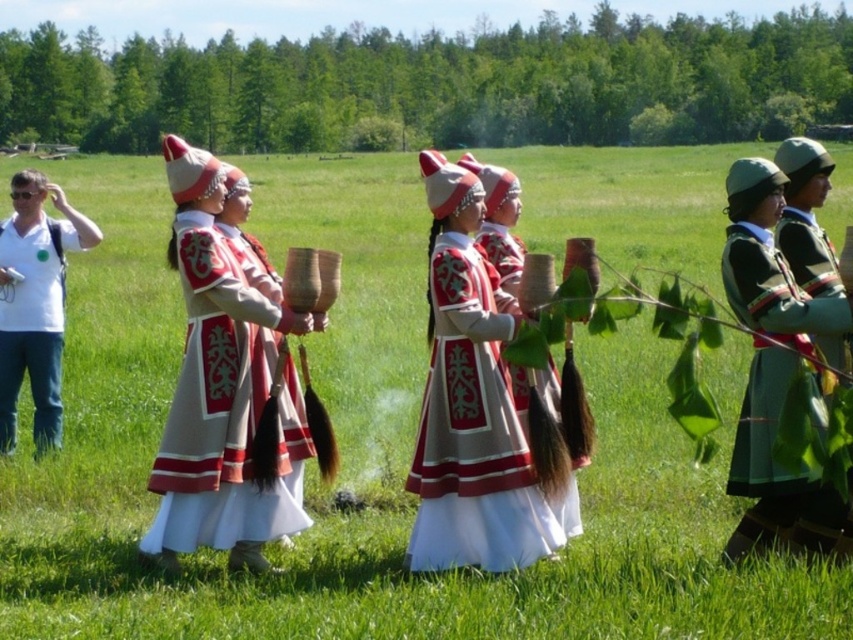
Can you confirm if green woolen jacket at right is wider than green matte jacket at right?

Yes, green woolen jacket at right is wider than green matte jacket at right.

Does green woolen jacket at right have a lesser width compared to green matte jacket at right?

No, green woolen jacket at right is not thinner than green matte jacket at right.

The height and width of the screenshot is (640, 853). In order to click on green woolen jacket at right in this screenshot , I will do `click(776, 397)`.

What do you see at coordinates (218, 404) in the screenshot?
I see `beige fabric dress at center` at bounding box center [218, 404].

Can you confirm if beige fabric dress at center is taller than green matte jacket at right?

Indeed, beige fabric dress at center has a greater height compared to green matte jacket at right.

Which is in front, point (178, 458) or point (822, 262)?

Point (822, 262) is more forward.

This screenshot has height=640, width=853. I want to click on beige fabric dress at center, so click(218, 404).

Does green woolen jacket at right have a greater height compared to embroidered silk dress at center?

Yes.

Can you confirm if green woolen jacket at right is wider than embroidered silk dress at center?

Yes.

Which is in front, point (769, 360) or point (560, 385)?

Positioned in front is point (769, 360).

This screenshot has height=640, width=853. In order to click on green woolen jacket at right in this screenshot , I will do `click(776, 397)`.